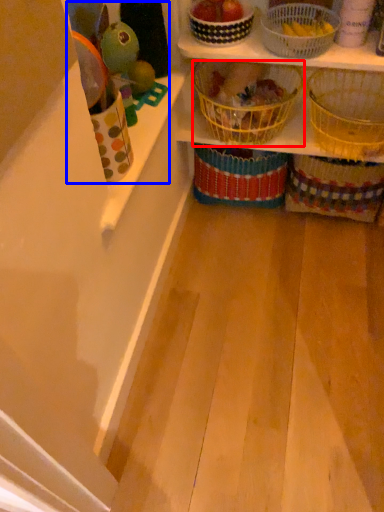
Question: Which object appears closest to the camera in this image, basket (highlighted by a red box) or toy (highlighted by a blue box)?

Choices:
 (A) basket
 (B) toy

Answer: (B)